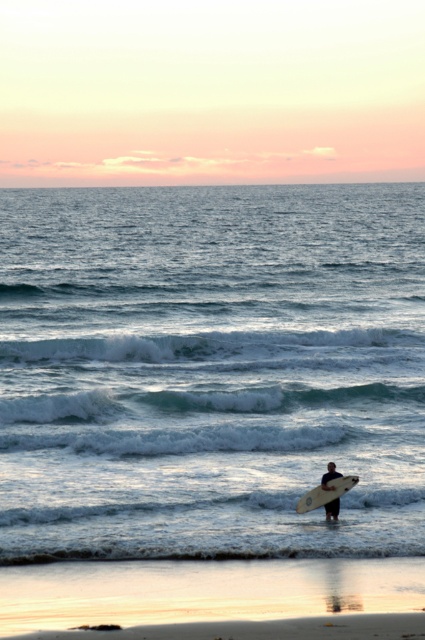
Is point (102, 394) positioned behind point (326, 481)?

That is True.

Is point (48, 413) less distant than point (302, 504)?

No, (48, 413) is behind (302, 504).

This screenshot has height=640, width=425. What do you see at coordinates (201, 403) in the screenshot?
I see `greenish-blue foam at lower center` at bounding box center [201, 403].

The width and height of the screenshot is (425, 640). Identify the location of greenish-blue foam at lower center. (201, 403).

Who is shorter, smooth sand at lower center or smooth white surfboard at lower center?

Standing shorter between the two is smooth sand at lower center.

Is smooth sand at lower center to the left of smooth white surfboard at lower center from the viewer's perspective?

Yes, smooth sand at lower center is to the left of smooth white surfboard at lower center.

Describe the element at coordinates (203, 589) in the screenshot. I see `smooth sand at lower center` at that location.

The height and width of the screenshot is (640, 425). I want to click on smooth sand at lower center, so click(x=203, y=589).

Is the position of white frothy wave at center less distant than that of smooth white surfboard at lower center?

No, white frothy wave at center is further to the viewer.

Who is positioned more to the right, white frothy wave at center or smooth white surfboard at lower center?

Positioned to the right is smooth white surfboard at lower center.

Between point (39, 346) and point (337, 499), which one is positioned behind?

Positioned behind is point (39, 346).

What are the coordinates of `white frothy wave at center` in the screenshot? It's located at (221, 348).